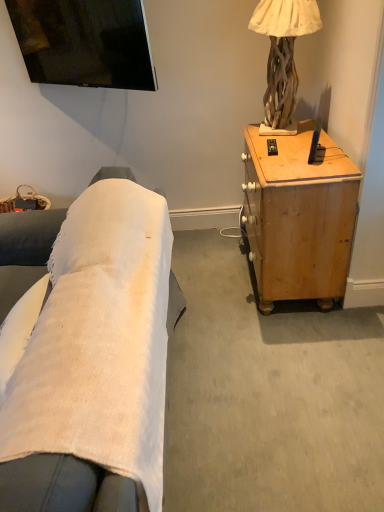
At what (x,y) coordinates should I click in order to perform the action: click on free spot to the right of black plastic remote control at upper right. Please return your answer as a coordinate pair (x, y). This screenshot has height=512, width=384. Looking at the image, I should click on tap(297, 149).